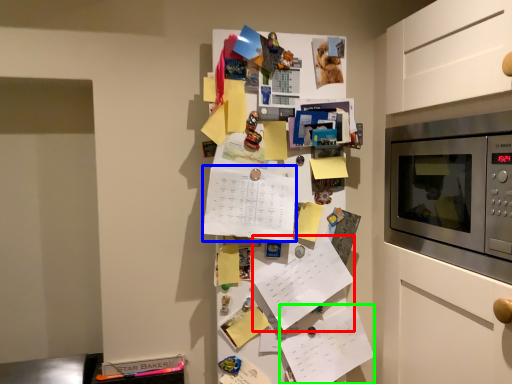
Question: Which object is positioned farthest from list (highlighted by a red box)? Select from list (highlighted by a blue box) and list (highlighted by a green box).

Choices:
 (A) list
 (B) list

Answer: (A)